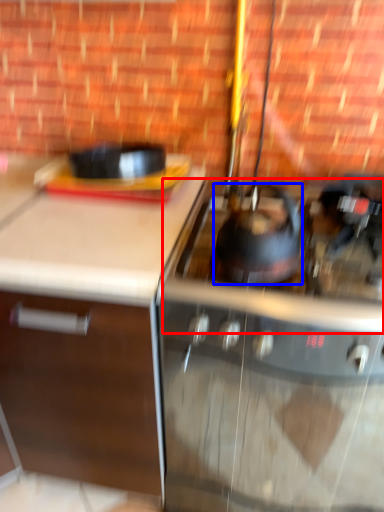
Question: Among these objects, which one is farthest to the camera, gas stove (highlighted by a red box) or kitchen appliance (highlighted by a blue box)?

Choices:
 (A) gas stove
 (B) kitchen appliance

Answer: (B)